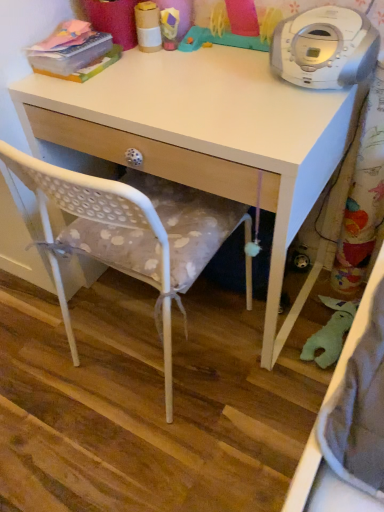
The height and width of the screenshot is (512, 384). Find the location of `vacant space underneath white polka dot fabric chair at center (from a real-world perspective)`. vacant space underneath white polka dot fabric chair at center (from a real-world perspective) is located at coordinates (143, 354).